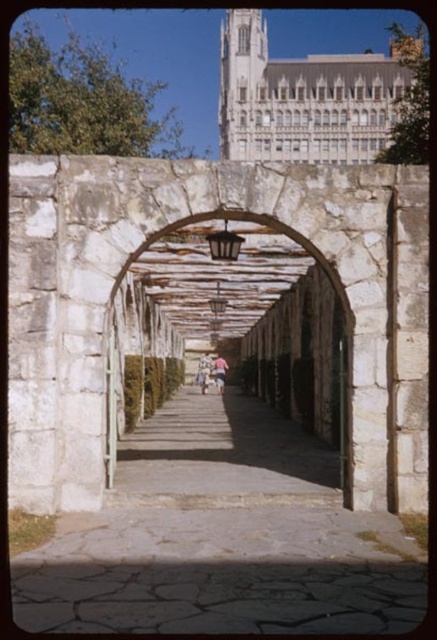
In the scene shown: Is the position of paved stone path at center less distant than that of light blue denim shorts at center?

Yes, it is in front of light blue denim shorts at center.

Which is more to the left, paved stone path at center or light blue denim shorts at center?

light blue denim shorts at center is more to the left.

Measure the distance between paved stone path at center and camera.

24.20 meters

Where is `paved stone path at center`? This screenshot has width=437, height=640. paved stone path at center is located at coordinates (221, 538).

Does light blue denim shorts at center appear under light brown fabric person at center?

Indeed, light blue denim shorts at center is positioned under light brown fabric person at center.

Find the location of a particular element. Image resolution: width=437 pixels, height=640 pixels. light blue denim shorts at center is located at coordinates (204, 372).

Who is higher up, paved stone path at center or wooden lattice archway at center?

wooden lattice archway at center is above.

Can you confirm if paved stone path at center is thinner than wooden lattice archway at center?

Indeed, paved stone path at center has a lesser width compared to wooden lattice archway at center.

Between point (325, 609) and point (174, 292), which one is positioned behind?

Positioned behind is point (174, 292).

The width and height of the screenshot is (437, 640). What are the coordinates of `paved stone path at center` in the screenshot? It's located at (221, 538).